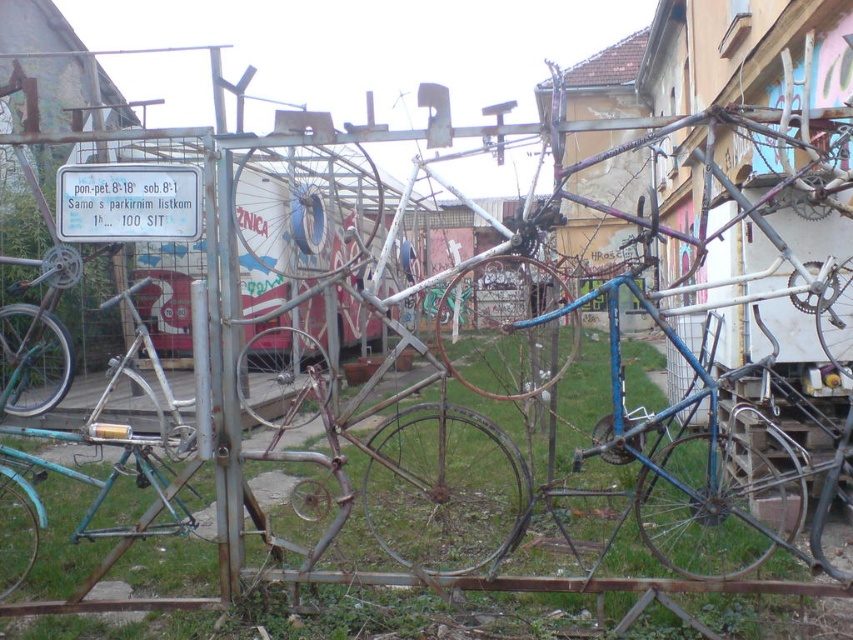
user is standing 5 feet away from the metal framework. They want to see the white plastic sign at upper left without moving their feet. Can they see it?

The white plastic sign at upper left is 9.00 feet away from the camera. Since the user is only 5 feet away from the metal framework, they are closer to the structure than the sign. This means the metal framework may block their view of the white plastic sign at upper left unless they move or adjust their position.

You are a delivery person who needs to park your bike near the white plastic sign at upper left and the brushed metal bicycle at left. The parking area has a width of 3 feet. Can your bike fit between them?

The distance between the white plastic sign at upper left and the brushed metal bicycle at left is 3.37 feet, which is wider than the 3 feet width of the parking area. Therefore, your bike can fit between them.

You are a visitor trying to park your bicycle near the metal framework. You see the white plastic sign at upper left and the brushed metal bicycle at left. Which object takes up more space in the scene?

The brushed metal bicycle at left occupies more space than the white plastic sign at upper left, so the bicycle takes up more space in the scene.